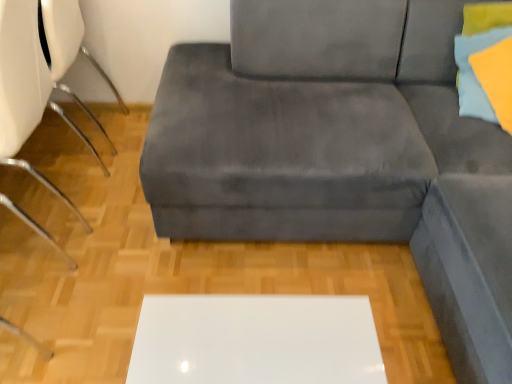
This screenshot has height=384, width=512. What are the coordinates of `spots to the right of white plastic chair at left` in the screenshot? It's located at (128, 230).